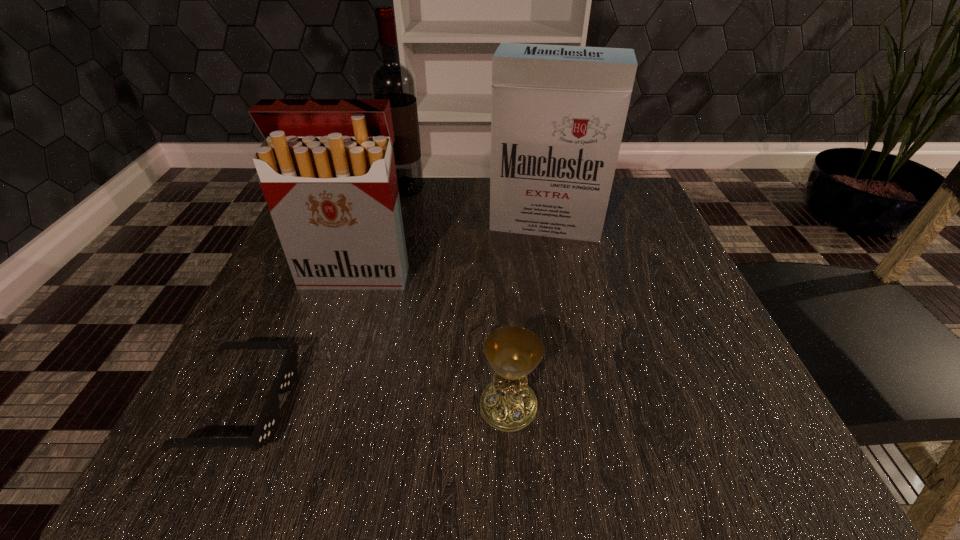
Where is `the farthest object`? The width and height of the screenshot is (960, 540). the farthest object is located at coordinates (391, 80).

You are a GUI agent. You are given a task and a screenshot of the screen. Output one action in this format:
    pyautogui.click(x=<x>, y=<y>)
    Task: Click on the right cigarette case
    This screenshot has height=540, width=960.
    Given the screenshot: What is the action you would take?
    pyautogui.click(x=558, y=113)

Where is `the farther cigarette case`? This screenshot has height=540, width=960. the farther cigarette case is located at coordinates (558, 113).

Find the location of a particular element. the third farthest object is located at coordinates (327, 170).

You are a GUI agent. You are given a task and a screenshot of the screen. Output one action in this format:
    pyautogui.click(x=<x>, y=<y>)
    Task: Click on the nearer cigarette case
    Image resolution: width=960 pixels, height=540 pixels.
    Given the screenshot: What is the action you would take?
    pyautogui.click(x=327, y=170)

You are a GUI agent. You are given a task and a screenshot of the screen. Output one action in this format:
    pyautogui.click(x=<x>, y=<y>)
    Task: Click on the chalice
    The height and width of the screenshot is (540, 960).
    Given the screenshot: What is the action you would take?
    pyautogui.click(x=508, y=404)

I want to click on the shortest object, so click(x=265, y=427).

The width and height of the screenshot is (960, 540). I want to click on vacant region located on the front of the wine bottle, so click(x=378, y=300).

Where is `vacant space located 0.070m on the front of the second farthest object`? Image resolution: width=960 pixels, height=540 pixels. vacant space located 0.070m on the front of the second farthest object is located at coordinates (554, 265).

The width and height of the screenshot is (960, 540). What are the coordinates of `vacant region located 0.130m with the lid open on the third farthest object` in the screenshot? It's located at [x=332, y=347].